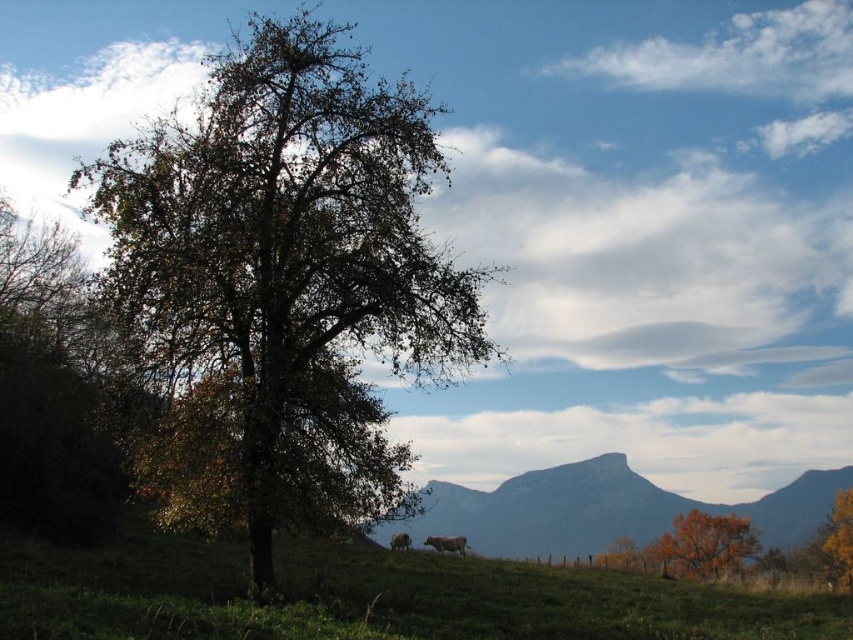
Is green leafy tree at center positioned before orange leafy tree at lower right?

That is True.

Can you confirm if green leafy tree at center is shorter than orange leafy tree at lower right?

No.

Describe the element at coordinates (283, 285) in the screenshot. This screenshot has width=853, height=640. I see `green leafy tree at center` at that location.

Locate an element on the screen. This screenshot has height=640, width=853. green leafy tree at center is located at coordinates (283, 285).

Is the position of green grassy field at lower center more distant than that of orange leafy tree at lower right?

No, green grassy field at lower center is in front of orange leafy tree at lower right.

Measure the distance from green grassy field at lower center to orange leafy tree at lower right.

53.05 feet

Is point (173, 552) closer to viewer compared to point (708, 560)?

Yes, it is.

Identify the location of green grassy field at lower center. Image resolution: width=853 pixels, height=640 pixels. (372, 596).

Which of these two, green leafy tree at center or smooth gray rock at center, stands shorter?

→ smooth gray rock at center

Describe the element at coordinates (283, 285) in the screenshot. Image resolution: width=853 pixels, height=640 pixels. I see `green leafy tree at center` at that location.

What are the coordinates of `green leafy tree at center` in the screenshot? It's located at (283, 285).